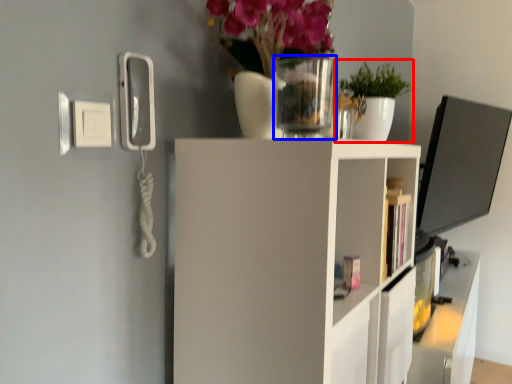
Question: Which object is further to the camera taking this photo, houseplant (highlighted by a red box) or glass vase (highlighted by a blue box)?

Choices:
 (A) houseplant
 (B) glass vase

Answer: (A)